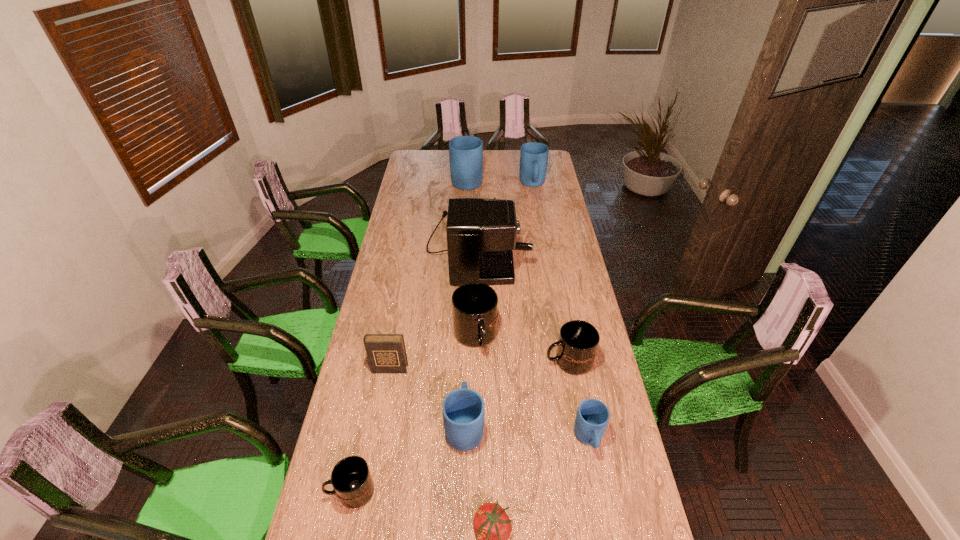
In the image, there is a desktop. At what (x,y) coordinates should I click in order to perform the action: click on free region at the right edge. Please return your answer as a coordinate pair (x, y). The width and height of the screenshot is (960, 540). Looking at the image, I should click on (602, 383).

Find the location of a particular element. unoccupied position between the nearest black mug and the smallest blue mug is located at coordinates (470, 465).

The width and height of the screenshot is (960, 540). Find the location of `free space between the smallest blue mug and the second smallest black mug`. free space between the smallest blue mug and the second smallest black mug is located at coordinates (579, 400).

Identify the location of empty space between the biggest black mug and the second smallest black mug. (522, 349).

Identify the location of free space between the second biggest black mug and the third biggest blue mug. (516, 394).

Identify the location of object that is the fifth closest to the biggest blue mug. This screenshot has height=540, width=960. (386, 353).

Point out which object is positioned as the nearest to the second biggest blue mug. Please provide its 2D coordinates. Your answer should be formatted as a tuple, i.e. [(x, y)], where the tuple contains the x and y coordinates of a point satisfying the conditions above.

[(481, 233)]

Image resolution: width=960 pixels, height=540 pixels. In order to click on the sixth closest mug to the third biggest blue mug in this screenshot , I will do tap(465, 152).

Point out which mug is positioned as the second nearest to the smallest black mug. Please provide its 2D coordinates. Your answer should be formatted as a tuple, i.e. [(x, y)], where the tuple contains the x and y coordinates of a point satisfying the conditions above.

[(474, 305)]

Select which blue mug is the second closest to the dark diary. Please provide its 2D coordinates. Your answer should be formatted as a tuple, i.e. [(x, y)], where the tuple contains the x and y coordinates of a point satisfying the conditions above.

[(592, 417)]